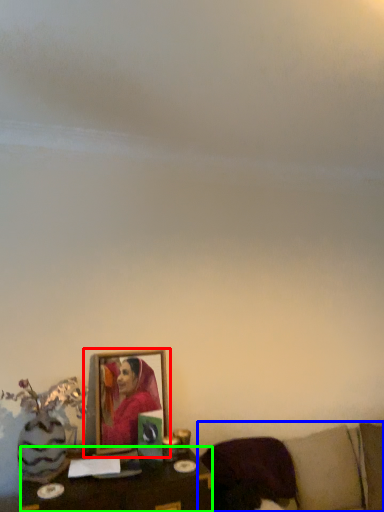
Question: Which is farther away from picture frame (highlighted by a red box)? furniture (highlighted by a blue box) or table (highlighted by a green box)?

Choices:
 (A) furniture
 (B) table

Answer: (A)